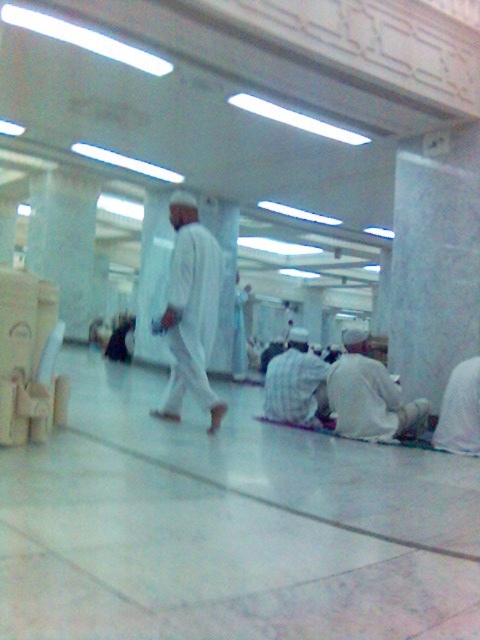
Can you confirm if white matte clothing at center is shorter than white matte robe at lower right?

Incorrect, white matte clothing at center's height does not fall short of white matte robe at lower right's.

From the picture: Is white matte clothing at center above white matte robe at lower right?

Correct, white matte clothing at center is located above white matte robe at lower right.

Locate an element on the screen. This screenshot has width=480, height=640. white matte clothing at center is located at coordinates coord(191,310).

Between checkered fabric robe at center and white matte robe at lower right, which one has more height?

With more height is white matte robe at lower right.

Identify the location of checkered fabric robe at center. (296, 387).

This screenshot has height=640, width=480. Find the location of `checkered fabric robe at center`. checkered fabric robe at center is located at coordinates (x=296, y=387).

Describe the element at coordinates (191, 310) in the screenshot. I see `white matte clothing at center` at that location.

Is point (195, 385) positioned behind point (278, 404)?

No, it is not.

At what (x,y) coordinates should I click in order to perform the action: click on white matte clothing at center. Please return your answer as a coordinate pair (x, y). This screenshot has height=640, width=480. Looking at the image, I should click on 191,310.